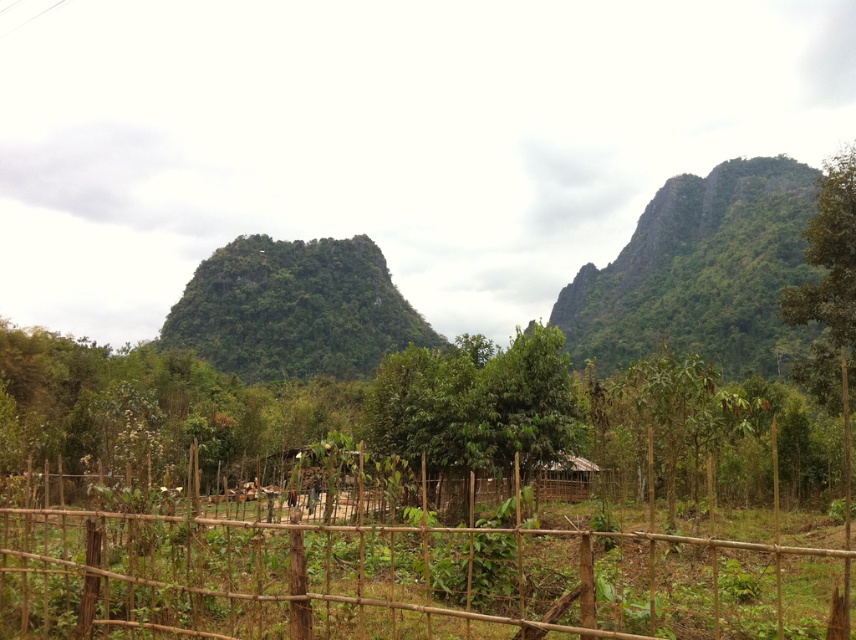
You are standing at the point marked as point (x=402, y=570) in the image. What object is located exactly at that point?

The bamboo fence at center is located exactly at point (x=402, y=570).

You are a landscape architect designing a new garden. You need to decide whether to place a 30cm wide decorative stone path between the bamboo fence at center and the green leafy mountain at upper right. Based on their widths, will the path fit between them?

The bamboo fence at center is thinner than the green leafy mountain at upper right. Since the path is 30cm wide, it can fit between them as long as the distance between the two objects allows for the path width. However, the description only mentions their relative widths, not the distance between them. More information about the spacing is needed to confirm.